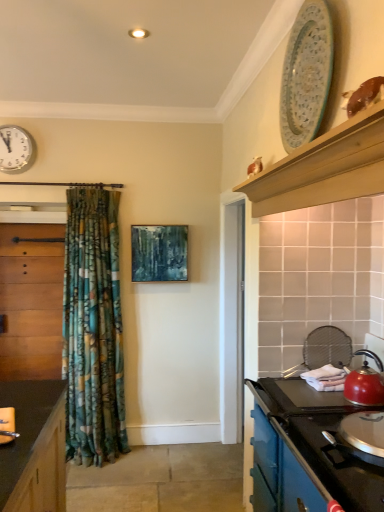
Where is `vacant region under teal matte painting at center (from a real-world perspective)`? The width and height of the screenshot is (384, 512). vacant region under teal matte painting at center (from a real-world perspective) is located at coordinates (155, 443).